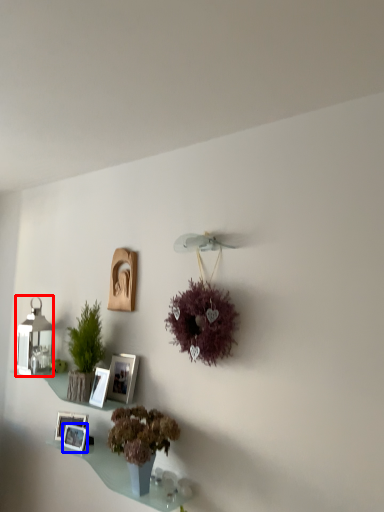
Question: Which object is further to the camera taking this photo, lamp (highlighted by a red box) or picture frame (highlighted by a blue box)?

Choices:
 (A) lamp
 (B) picture frame

Answer: (A)